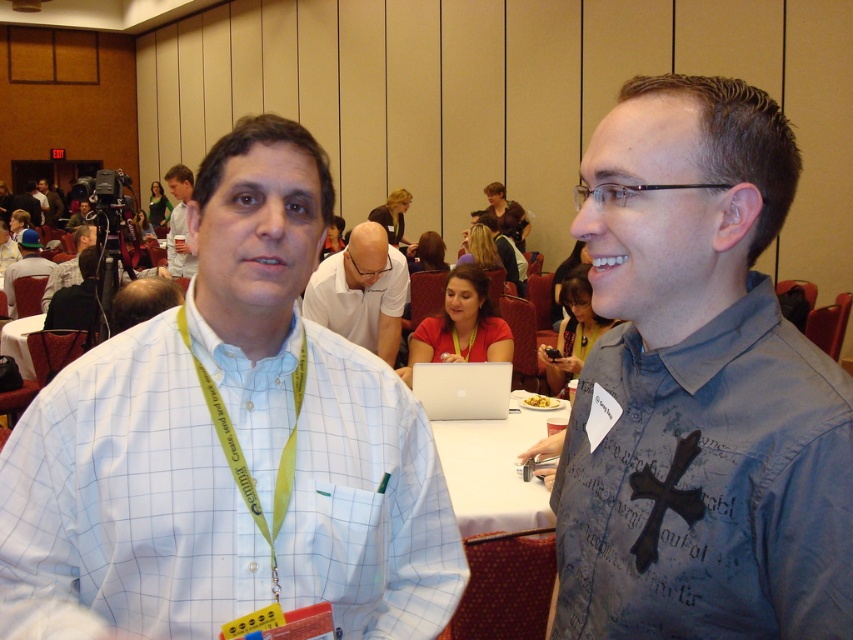
Question: Is silver metallic laptop at center positioned before matte black camera at left?

Choices:
 (A) no
 (B) yes

Answer: (B)

Question: Estimate the real-world distances between objects in this image. Which object is closer to the white matte shirt at center?

Choices:
 (A) silver metallic laptop at center
 (B) matte black chair at left
 (C) matte black camera at left
 (D) blue fabric shirt at center

Answer: (A)

Question: Which object appears closest to the camera in this image?

Choices:
 (A) blue fabric shirt at center
 (B) matte black chair at left

Answer: (A)

Question: Does blue fabric shirt at center have a lesser width compared to green fabric lanyard at center?

Choices:
 (A) no
 (B) yes

Answer: (A)

Question: Where is white glossy table at center located in relation to light blue shirt at upper left in the image?

Choices:
 (A) below
 (B) above

Answer: (A)

Question: Which is nearer to the matte black camera at left?

Choices:
 (A) light blue shirt at upper left
 (B) white glossy table at center
 (C) green fabric lanyard at center

Answer: (A)